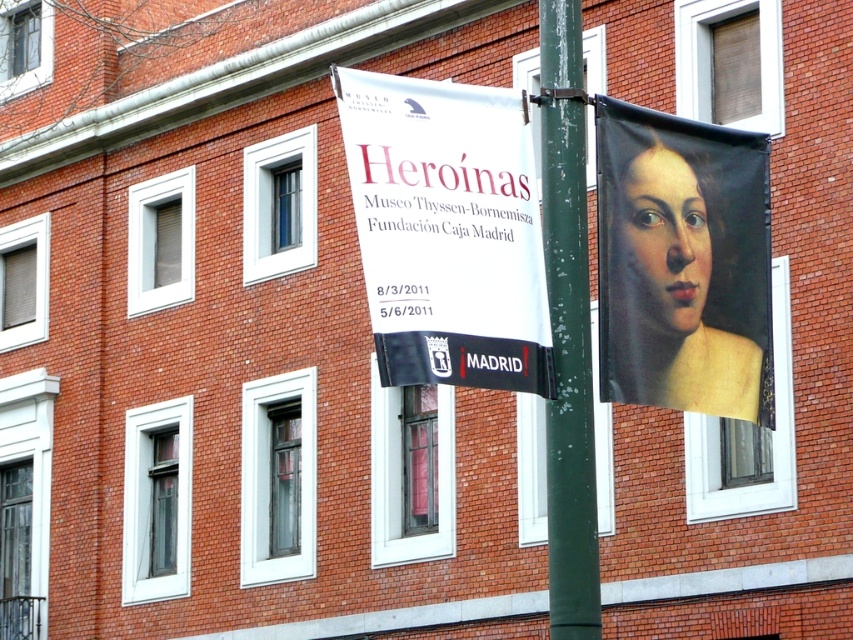
You are standing in front of the brick building and notice the smooth canvas portrait at right and the green painted metal pole at center. Which object is positioned farther to the right from your perspective?

The smooth canvas portrait at right is positioned farther to the right than the green painted metal pole at center.

From the picture: You are standing in front of the brick building and notice the white paper banner at upper center and the green painted metal pole at center. Which object is nearer to you?

The white paper banner at upper center is closer to the viewer than the green painted metal pole at center.